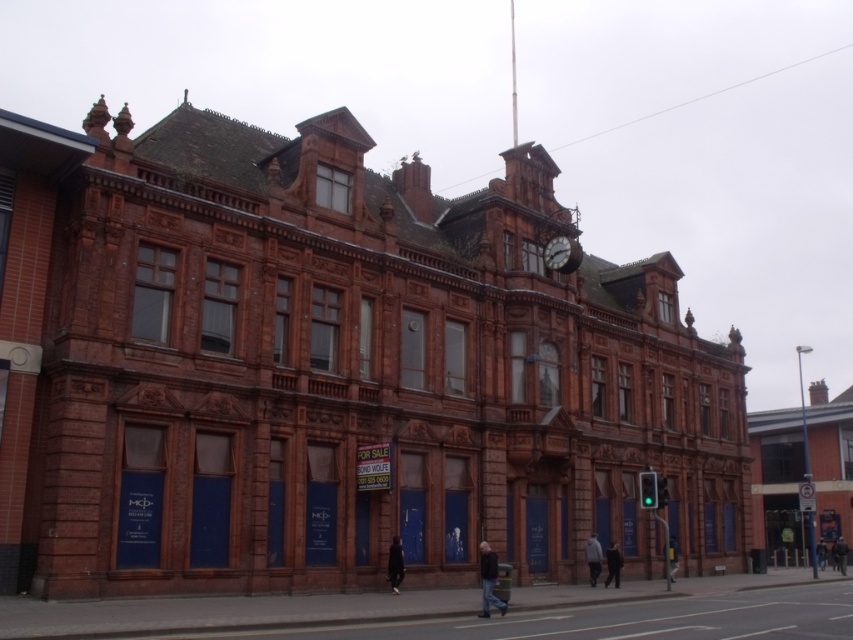
Is dark blue jeans at lower center shorter than dark gray jacket at center?

Yes.

Between point (392, 592) and point (842, 561), which one is positioned behind?

The point (842, 561) is behind.

Find the location of a particular element. This screenshot has width=853, height=640. dark blue jeans at lower center is located at coordinates (395, 564).

In the scene shown: Which is more to the left, dark blue jeans at lower center or dark blue jeans at lower right?

dark blue jeans at lower center

Locate an element on the screen. The width and height of the screenshot is (853, 640). dark blue jeans at lower center is located at coordinates (395, 564).

Locate an element on the screen. The height and width of the screenshot is (640, 853). dark blue jeans at lower center is located at coordinates (395, 564).

From the picture: Is the position of dark blue jeans at lower center less distant than that of dark blue jacket at lower right?

That is True.

Who is taller, dark blue jeans at lower center or dark blue jacket at lower right?

dark blue jeans at lower center is taller.

Locate an element on the screen. The width and height of the screenshot is (853, 640). dark blue jeans at lower center is located at coordinates (395, 564).